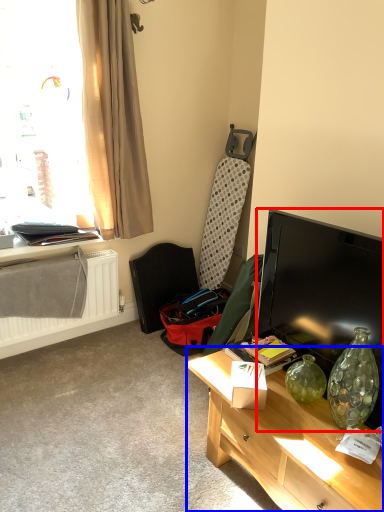
Question: Which point is closer to the camera, television (highlighted by a red box) or desk (highlighted by a blue box)?

Choices:
 (A) television
 (B) desk

Answer: (B)